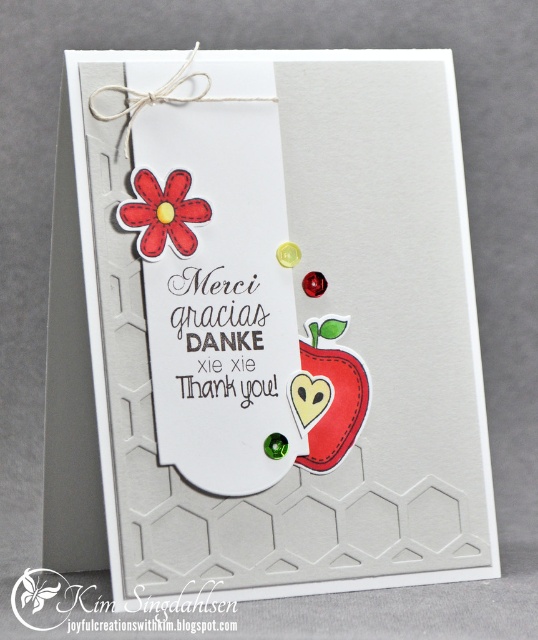
Question: Can you confirm if matte white tag at center is smaller than matte red flower at upper left?

Choices:
 (A) no
 (B) yes

Answer: (A)

Question: Is the position of matte paper tag at center more distant than that of matte white tag at center?

Choices:
 (A) no
 (B) yes

Answer: (A)

Question: Which object is positioned closest to the matte white tag at center?

Choices:
 (A) matte paper tag at center
 (B) matte red flower at upper left

Answer: (A)

Question: Which object appears farthest from the camera in this image?

Choices:
 (A) matte paper tag at center
 (B) matte white tag at center

Answer: (B)

Question: Which point is farther to the camera?

Choices:
 (A) matte white tag at center
 (B) matte red flower at upper left
 (C) matte paper tag at center

Answer: (B)

Question: From the image, what is the correct spatial relationship of matte paper tag at center in relation to matte red flower at upper left?

Choices:
 (A) above
 (B) below

Answer: (B)